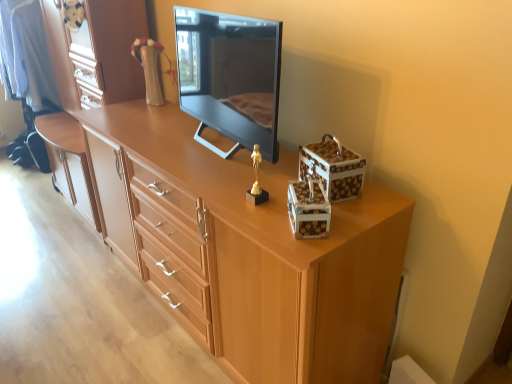
Locate an element on the screen. Image resolution: width=512 pixels, height=384 pixels. free region on the left part of white glossy storage box at upper right, marked as the second storage box in a back-to-front arrangement is located at coordinates (262, 218).